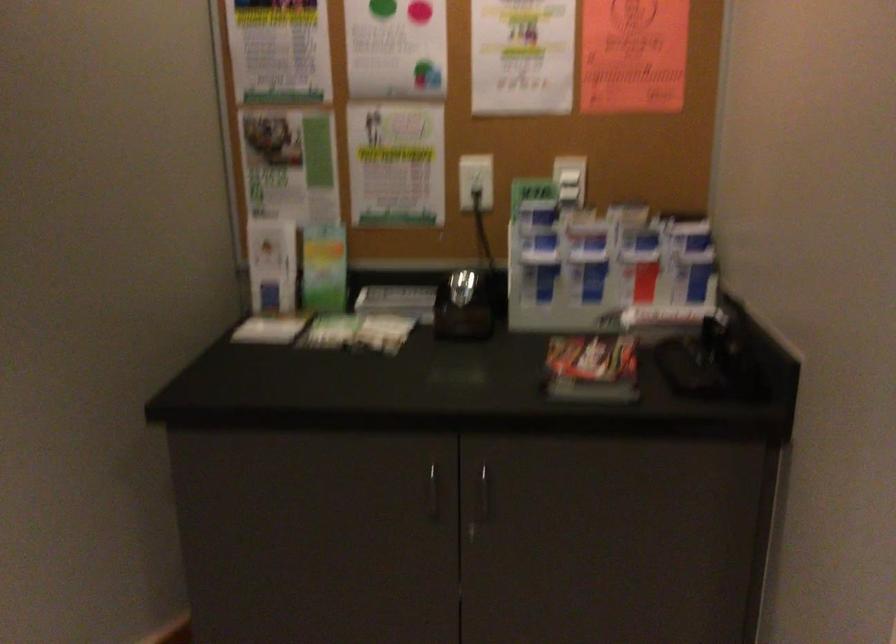
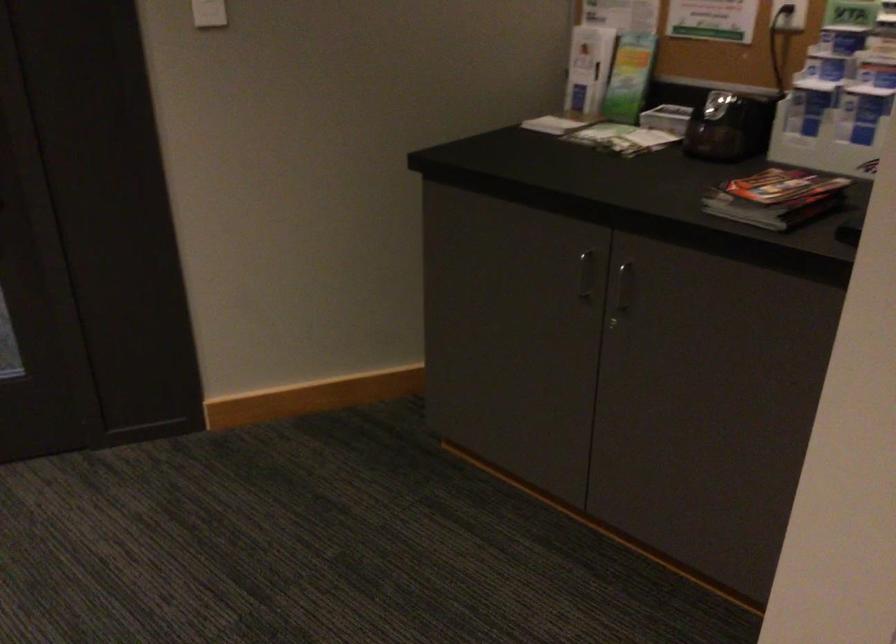
In the second image, find the point that corresponds to (269,325) in the first image.

(556, 122)